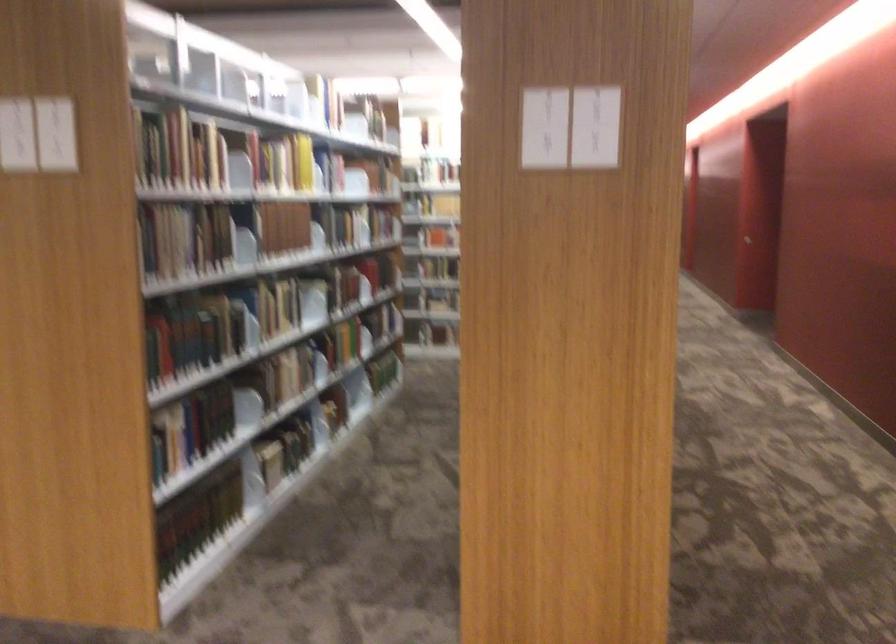
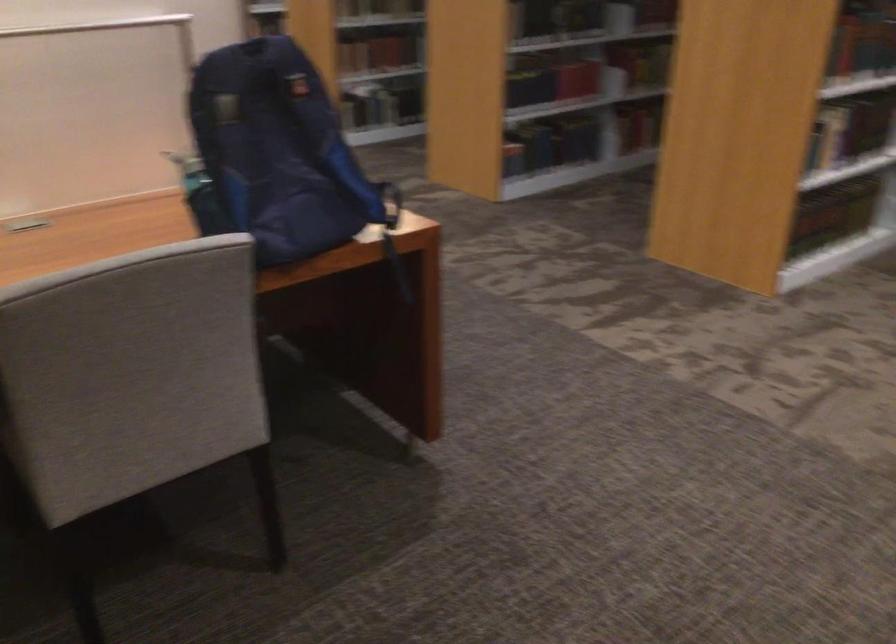
How did the camera likely rotate?

The camera rotated toward left-down.